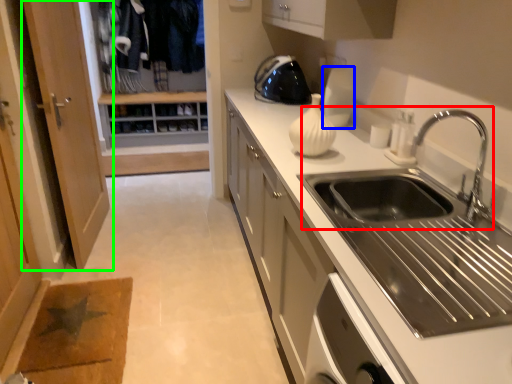
Question: Considering the real-world distances, which object is closest to sink (highlighted by a red box)? appliance (highlighted by a blue box) or door (highlighted by a green box).

Choices:
 (A) appliance
 (B) door

Answer: (A)